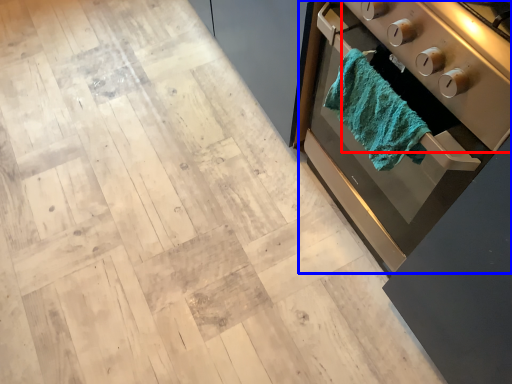
Question: Among these objects, which one is nearest to the camera, appliance (highlighted by a red box) or home appliance (highlighted by a blue box)?

Choices:
 (A) appliance
 (B) home appliance

Answer: (A)